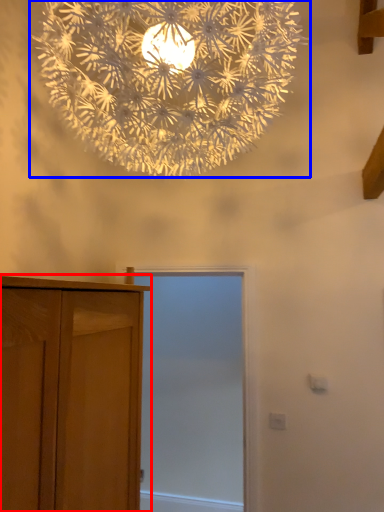
Question: Among these objects, which one is nearest to the camera, cupboard (highlighted by a red box) or lamp (highlighted by a blue box)?

Choices:
 (A) cupboard
 (B) lamp

Answer: (A)